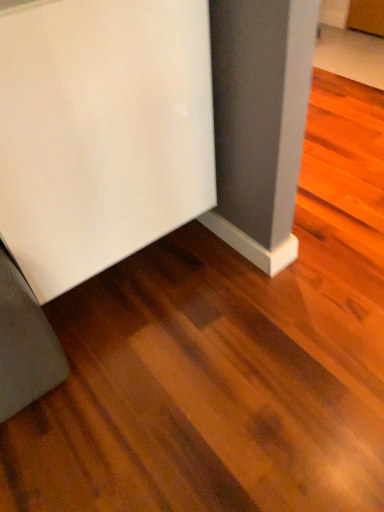
Question: Considering the relative sizes of white glossy refrigerator at lower left, which ranks as the 2th furniture in bottom-to-top order, and matte gray baseboard at lower left, which appears as the first furniture when ordered from the bottom, in the image provided, is white glossy refrigerator at lower left, which ranks as the 2th furniture in bottom-to-top order, shorter than matte gray baseboard at lower left, which appears as the first furniture when ordered from the bottom,?

Choices:
 (A) no
 (B) yes

Answer: (A)

Question: Is white glossy refrigerator at lower left, which ranks as the 2th furniture in bottom-to-top order, oriented towards matte gray baseboard at lower left, which appears as the first furniture when ordered from the bottom?

Choices:
 (A) yes
 (B) no

Answer: (B)

Question: Considering the relative sizes of white glossy refrigerator at lower left, the first furniture from the top, and matte gray baseboard at lower left, positioned as the second furniture in top-to-bottom order, in the image provided, is white glossy refrigerator at lower left, the first furniture from the top, wider than matte gray baseboard at lower left, positioned as the second furniture in top-to-bottom order,?

Choices:
 (A) no
 (B) yes

Answer: (A)

Question: Is white glossy refrigerator at lower left, which ranks as the 2th furniture in bottom-to-top order, far from matte gray baseboard at lower left, positioned as the second furniture in top-to-bottom order?

Choices:
 (A) no
 (B) yes

Answer: (A)

Question: Does white glossy refrigerator at lower left, the first furniture from the top, have a greater height compared to matte gray baseboard at lower left, positioned as the second furniture in top-to-bottom order?

Choices:
 (A) yes
 (B) no

Answer: (A)

Question: From the image's perspective, does white glossy refrigerator at lower left, the first furniture from the top, appear higher than matte gray baseboard at lower left, which appears as the first furniture when ordered from the bottom?

Choices:
 (A) no
 (B) yes

Answer: (B)

Question: Is matte gray baseboard at lower left, which appears as the first furniture when ordered from the bottom, shorter than white glossy refrigerator at lower left, which ranks as the 2th furniture in bottom-to-top order?

Choices:
 (A) no
 (B) yes

Answer: (B)

Question: Can you confirm if matte gray baseboard at lower left, which appears as the first furniture when ordered from the bottom, is bigger than white glossy refrigerator at lower left, the first furniture from the top?

Choices:
 (A) yes
 (B) no

Answer: (B)

Question: Is matte gray baseboard at lower left, which appears as the first furniture when ordered from the bottom, looking in the opposite direction of white glossy refrigerator at lower left, the first furniture from the top?

Choices:
 (A) yes
 (B) no

Answer: (B)

Question: Does matte gray baseboard at lower left, positioned as the second furniture in top-to-bottom order, have a lesser width compared to white glossy refrigerator at lower left, which ranks as the 2th furniture in bottom-to-top order?

Choices:
 (A) no
 (B) yes

Answer: (A)

Question: From a real-world perspective, is matte gray baseboard at lower left, which appears as the first furniture when ordered from the bottom, located beneath white glossy refrigerator at lower left, the first furniture from the top?

Choices:
 (A) no
 (B) yes

Answer: (B)

Question: Is matte gray baseboard at lower left, positioned as the second furniture in top-to-bottom order, directly adjacent to white glossy refrigerator at lower left, the first furniture from the top?

Choices:
 (A) no
 (B) yes

Answer: (A)

Question: Considering the positions of white glossy refrigerator at lower left, the first furniture from the top, and matte gray baseboard at lower left, which appears as the first furniture when ordered from the bottom, in the image, is white glossy refrigerator at lower left, the first furniture from the top, taller or shorter than matte gray baseboard at lower left, which appears as the first furniture when ordered from the bottom,?

Choices:
 (A) short
 (B) tall

Answer: (B)